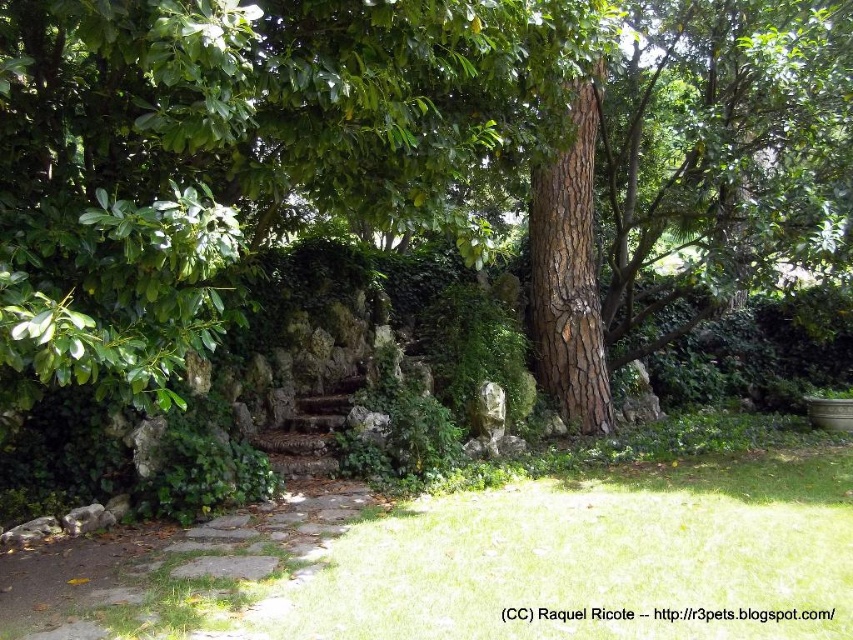
Is brown rough tree at center wider than brown stone path at lower center?

No, brown rough tree at center is not wider than brown stone path at lower center.

Between point (77, 294) and point (328, 536), which one is positioned behind?

Positioned behind is point (328, 536).

Is point (440, 172) positioned behind point (33, 561)?

No, (440, 172) is closer to viewer.

At what (x,y) coordinates should I click in order to perform the action: click on brown rough tree at center. Please return your answer as a coordinate pair (x, y). Looking at the image, I should click on (289, 160).